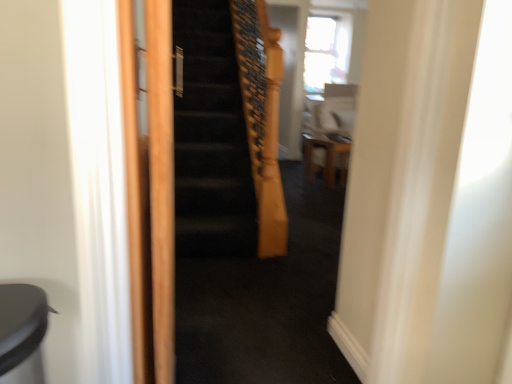
Question: Is point (125, 28) positioned closer to the camera than point (311, 158)?

Choices:
 (A) farther
 (B) closer

Answer: (B)

Question: Considering the positions of wooden screen door at center and wooden stool at center in the image, is wooden screen door at center taller or shorter than wooden stool at center?

Choices:
 (A) tall
 (B) short

Answer: (A)

Question: Considering the positions of wooden screen door at center and wooden stool at center in the image, is wooden screen door at center bigger or smaller than wooden stool at center?

Choices:
 (A) small
 (B) big

Answer: (A)

Question: Considering the positions of wooden stool at center and wooden screen door at center in the image, is wooden stool at center taller or shorter than wooden screen door at center?

Choices:
 (A) short
 (B) tall

Answer: (A)

Question: Is wooden stool at center inside the boundaries of wooden screen door at center, or outside?

Choices:
 (A) outside
 (B) inside

Answer: (A)

Question: Visually, is wooden stool at center positioned to the left or to the right of wooden screen door at center?

Choices:
 (A) left
 (B) right

Answer: (B)

Question: Considering their positions, is wooden stool at center located in front of or behind wooden screen door at center?

Choices:
 (A) front
 (B) behind

Answer: (B)